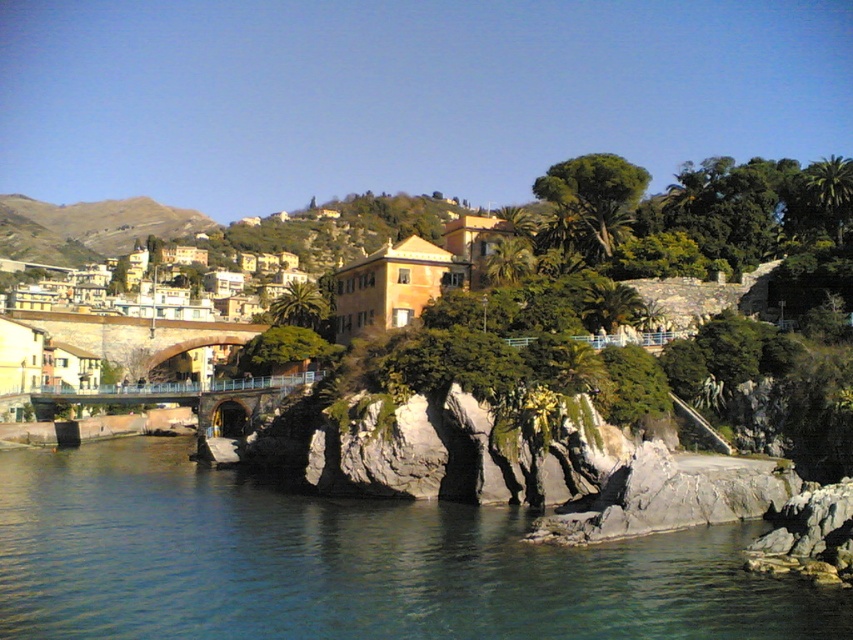
You are a tourist standing at the edge of the cliff overlooking the clear water at lower left and the yellowish stucco houses at upper left. Which of the two objects appears closer to you?

The clear water at lower left appears closer because it is located at the lower part of the image, which typically corresponds to the foreground in such scenes, making it visually nearer to the observer compared to the yellowish stucco houses at upper left positioned higher up, usually indicating a more distant placement.

You are a tourist planning to take a photo of the yellowish stucco houses at upper left and the metallic bridge at center from a spot near the cliffs. Which object should you focus on first if you want to capture both in a single frame without moving your camera?

You should focus on the yellowish stucco houses at upper left first because they might be wider than the metallic bridge at center, so ensuring they fit properly will help include both in the frame.

You are a tourist standing on the beach looking at the scene. You notice the yellowish stucco houses at upper left and the metallic bridge at center. Which of these two structures appears taller from your vantage point?

The yellowish stucco houses at upper left appears taller than the metallic bridge at center from your vantage point on the beach.